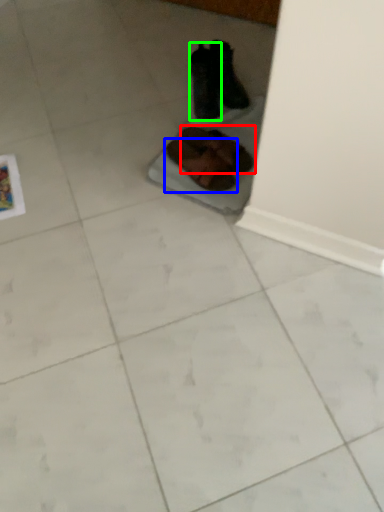
Question: Considering the real-world distances, which object is closest to footwear (highlighted by a red box)? footwear (highlighted by a blue box) or footwear (highlighted by a green box).

Choices:
 (A) footwear
 (B) footwear

Answer: (A)